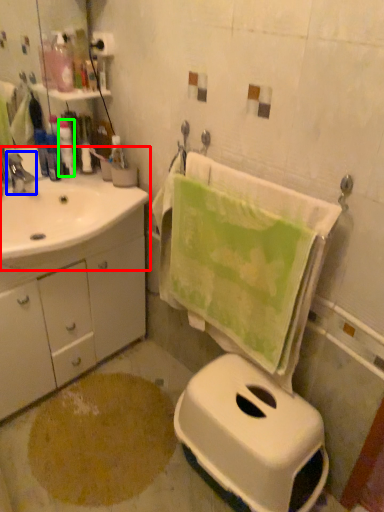
Question: Estimate the real-world distances between objects in this image. Which object is farther from sink (highlighted by a red box), tap (highlighted by a blue box) or toiletry (highlighted by a green box)?

Choices:
 (A) tap
 (B) toiletry

Answer: (B)